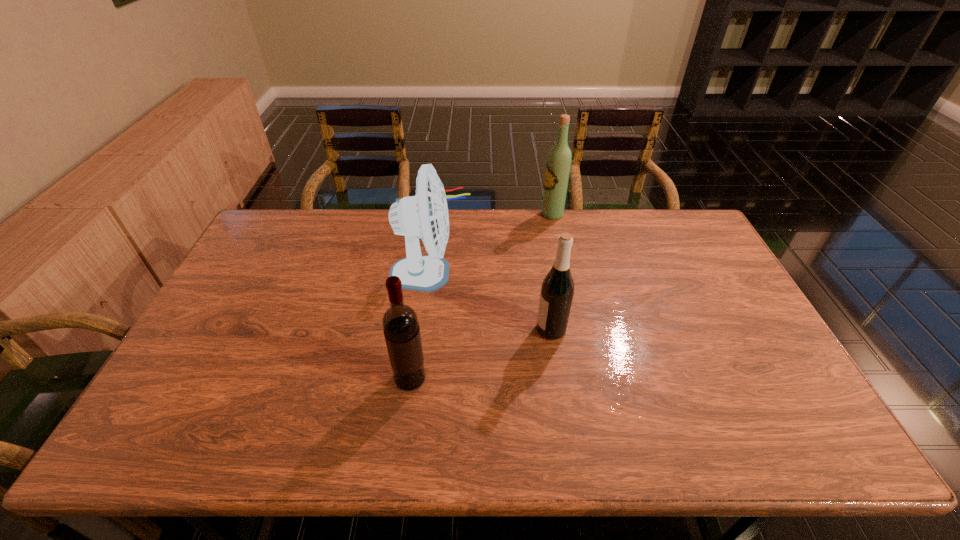
Find the location of a particular element. the farthest object is located at coordinates (558, 165).

The image size is (960, 540). I want to click on the second farthest object, so click(425, 215).

The height and width of the screenshot is (540, 960). Identify the location of the leftmost wine bottle. (400, 323).

In order to click on the nearest object in this screenshot , I will do `click(400, 323)`.

This screenshot has width=960, height=540. In order to click on the second nearest wine bottle in this screenshot , I will do `click(557, 290)`.

In order to click on free location located 0.100m on the front-facing side of the farthest object in this screenshot , I will do [515, 214].

Find the location of `free space located on the front-facing side of the farthest object`. free space located on the front-facing side of the farthest object is located at coordinates (498, 214).

I want to click on free space located 0.060m on the front-facing side of the farthest object, so click(x=525, y=214).

The height and width of the screenshot is (540, 960). I want to click on vacant region located on the grille of the third nearest object, so click(496, 273).

Locate an element on the screen. This screenshot has width=960, height=540. free location located on the back of the leftmost wine bottle is located at coordinates (422, 288).